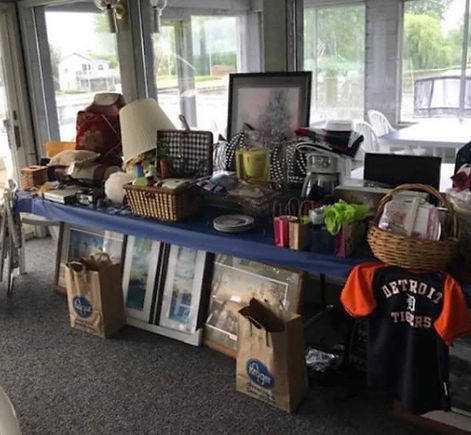
Image resolution: width=471 pixels, height=435 pixels. What are the coordinates of `carpet` in the screenshot? It's located at (174, 415), (100, 367), (27, 330).